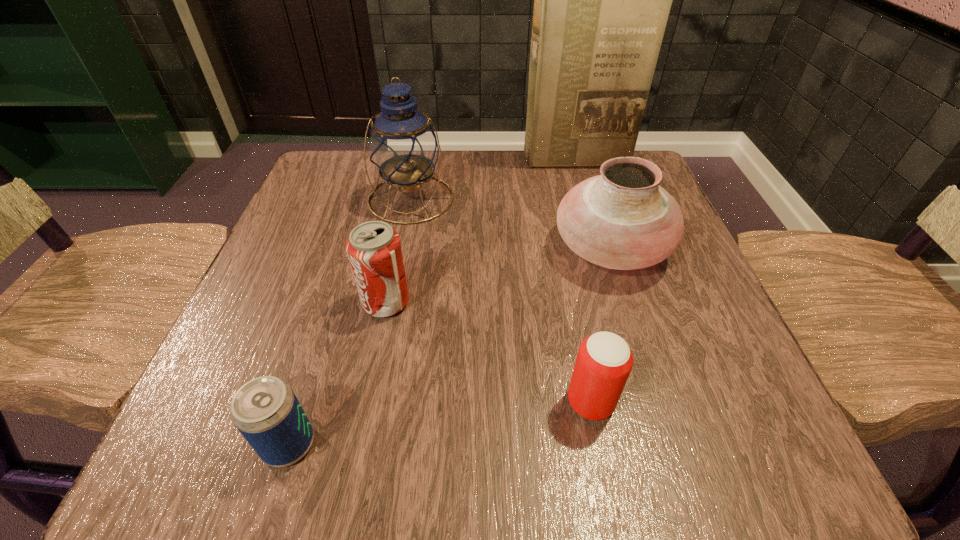
Identify the location of the farthest object. This screenshot has width=960, height=540. (602, 0).

Find the location of a particular element. the tallest object is located at coordinates (602, 0).

Find the location of a particular element. Image resolution: width=960 pixels, height=540 pixels. lantern is located at coordinates (403, 145).

Image resolution: width=960 pixels, height=540 pixels. I want to click on pottery, so click(622, 219).

Identify the location of soda can. (374, 250).

Locate an element on the screen. Image resolution: width=960 pixels, height=540 pixels. the right beer can is located at coordinates (604, 361).

Image resolution: width=960 pixels, height=540 pixels. Find the location of `the left beer can`. the left beer can is located at coordinates (265, 410).

Where is `vacant point located 0.100m on the cover of the phonebook`? This screenshot has height=540, width=960. vacant point located 0.100m on the cover of the phonebook is located at coordinates (584, 193).

Locate an element on the screen. vacant space located on the front-facing side of the lantern is located at coordinates (388, 318).

Identify the location of vacant space located 0.220m on the back of the pottery. (582, 157).